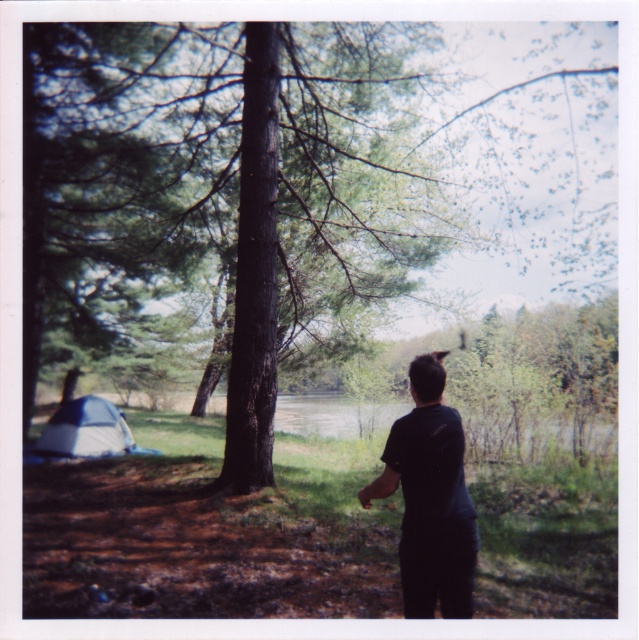
You are standing in the camping area and want to locate the green rough bark tree at center. According to the coordinates provided, where should you look relative to the blue and white tent?

The green rough bark tree at center is located at point (279,189), which is to the right of the blue and white tent on the left.

You are standing at the point with coordinates point [63,444] and want to walk to the point [412,410]. Which direction should you walk to reach your destination?

You should walk towards the direction where point [412,410] is located, which is in front of point [63,444].

In the scene shown: You are standing at the point labeled as point [279,189] in the image. Based on the scene, what type of surface are you standing on?

The point [279,189] is on green rough bark tree at center, so you are standing on a tree trunk with rough bark.